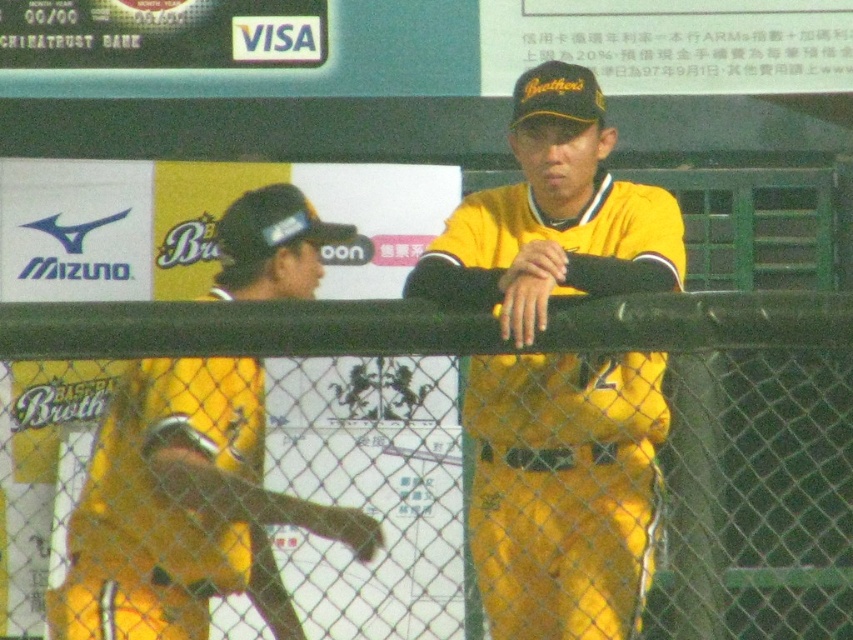
Does yellow matte uniform at center lie in front of black chain-link fence at center?

That is False.

Does yellow matte uniform at center have a greater width compared to black chain-link fence at center?

No.

Is point (590, 508) farther from camera compared to point (595, 320)?

Yes, it is.

Find the location of a particular element. This screenshot has width=853, height=640. yellow matte uniform at center is located at coordinates (563, 490).

Between point (579, 632) and point (171, 497), which one is positioned in front?

Positioned in front is point (171, 497).

Can you confirm if yellow matte uniform at center is positioned to the right of yellow matte baseball bat at left?

Indeed, yellow matte uniform at center is positioned on the right side of yellow matte baseball bat at left.

Is point (532, 237) farther from camera compared to point (85, 577)?

That is True.

You are a GUI agent. You are given a task and a screenshot of the screen. Output one action in this format:
    pyautogui.click(x=<x>, y=<y>)
    Task: Click on the yellow matte uniform at center
    Image resolution: width=853 pixels, height=640 pixels.
    Given the screenshot: What is the action you would take?
    pyautogui.click(x=563, y=490)

Which is more to the right, yellow matte baseball bat at left or black chain-link fence at center?

black chain-link fence at center

Between yellow matte baseball bat at left and black chain-link fence at center, which one is positioned lower?

yellow matte baseball bat at left

Measure the distance between point (285, 273) and camera.

Point (285, 273) and camera are 8.66 meters apart.

This screenshot has height=640, width=853. I want to click on yellow matte baseball bat at left, so click(183, 508).